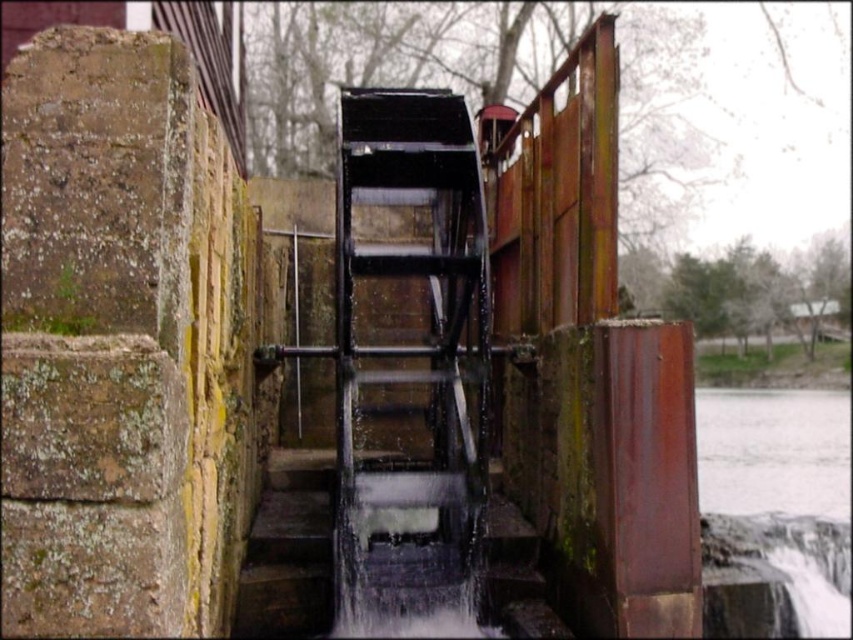
Is white frothy water at lower right positioned in front of rusty metal stairs at center?

That is True.

Does white frothy water at lower right have a larger size compared to rusty metal stairs at center?

Indeed, white frothy water at lower right has a larger size compared to rusty metal stairs at center.

Is point (705, 429) farther from camera compared to point (292, 628)?

Yes, point (705, 429) is farther from viewer.

What are the coordinates of `white frothy water at lower right` in the screenshot? It's located at (775, 512).